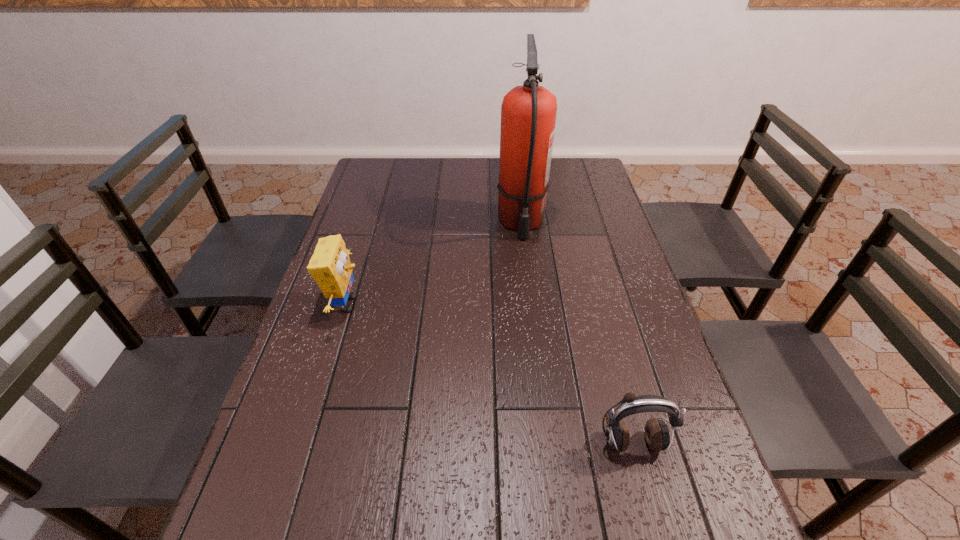
The height and width of the screenshot is (540, 960). I want to click on object that is positioned at the right edge, so pos(657,435).

In the image, there is a desktop. At what (x,y) coordinates should I click in order to perform the action: click on vacant region at the far edge. Please return your answer as a coordinate pair (x, y). This screenshot has height=540, width=960. Looking at the image, I should click on (554, 178).

This screenshot has width=960, height=540. Find the location of `free location at the left edge of the desktop`. free location at the left edge of the desktop is located at coordinates (351, 224).

The image size is (960, 540). Find the location of `free space at the right edge`. free space at the right edge is located at coordinates (620, 259).

At what (x,y) coordinates should I click in order to perform the action: click on vacant region at the far left corner of the desktop. Please return your answer as a coordinate pair (x, y). This screenshot has width=960, height=540. Looking at the image, I should click on (396, 180).

The image size is (960, 540). Identify the location of free spot at the far right corner of the desktop. (603, 183).

At what (x,y) coordinates should I click in order to perform the action: click on empty space that is in between the fire extinguisher and the earphone. Please return your answer as a coordinate pair (x, y). The height and width of the screenshot is (540, 960). Looking at the image, I should click on [576, 333].

Identify the location of vacant point located between the second object from left to right and the nearest object. This screenshot has height=540, width=960. (576, 333).

Find the location of a particular element. This screenshot has height=540, width=960. free space between the leftmost object and the second object from right to left is located at coordinates (434, 264).

What are the coordinates of `vacant region between the rightmost object and the fire extinguisher` in the screenshot? It's located at (576, 333).